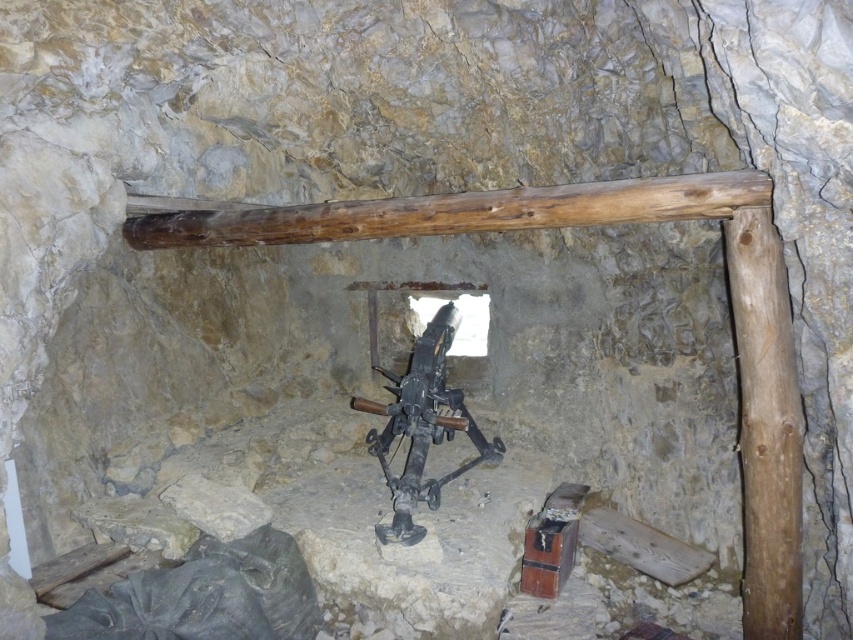
Looking at this image, you are an engineer inspecting the structural integrity of the stone structure. You notice the brown wooden beam at upper center. Based on its position, can you determine if it is centrally aligned with the opening below it?

The brown wooden beam at upper center is located at point (450, 211), so it is centrally aligned with the opening below it.

You are an engineer inspecting the stone structure. You notice the brown wooden beam at upper center and the rusty metal crossbow at center. Which object is smaller in size?

The brown wooden beam at upper center is smaller in size compared to the rusty metal crossbow at center.

You are standing at the entrance of the stone structure and want to move towards the back wall. There are two points marked in the image, point 1 at coordinate (596, 196) and point 2 at coordinate (432, 426). Which point should you pass through first as you move towards the back wall?

You should pass through point 1 at coordinate (596, 196) first because it is in front of point 2 at coordinate (432, 426).